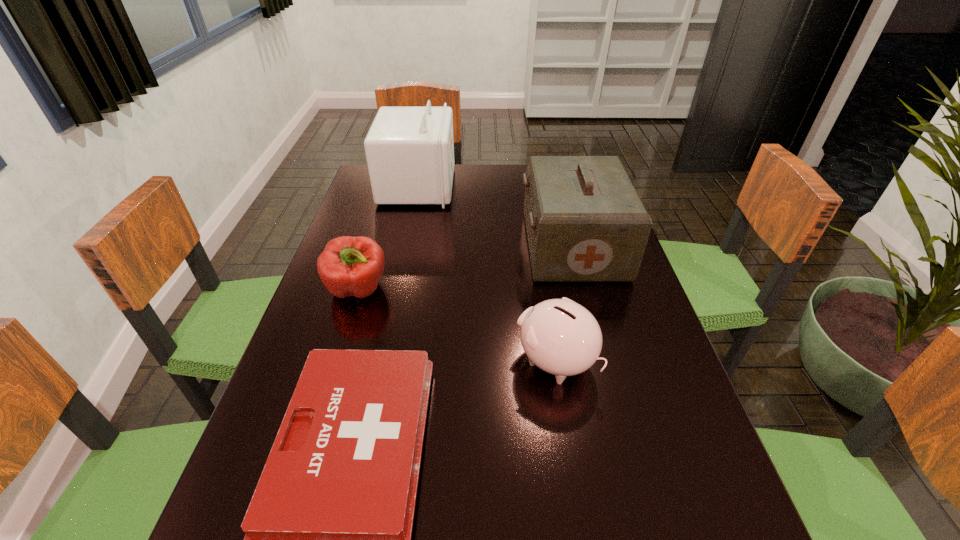
This screenshot has height=540, width=960. I want to click on free point between the bell pepper and the piggy bank, so click(x=457, y=326).

I want to click on vacant area that lies between the piggy bank and the bell pepper, so click(x=457, y=326).

This screenshot has height=540, width=960. I want to click on vacant region between the farthest first-aid kit and the piggy bank, so click(x=487, y=274).

Select which object appears as the closest to the tallest first-aid kit. Please provide its 2D coordinates. Your answer should be formatted as a tuple, i.e. [(x, y)], where the tuple contains the x and y coordinates of a point satisfying the conditions above.

[(585, 221)]

Locate which object ranks fourth in proximity to the second shortest first-aid kit. Please provide its 2D coordinates. Your answer should be formatted as a tuple, i.e. [(x, y)], where the tuple contains the x and y coordinates of a point satisfying the conditions above.

[(349, 266)]

Select which first-aid kit appears as the closest to the shortest object. Please provide its 2D coordinates. Your answer should be formatted as a tuple, i.e. [(x, y)], where the tuple contains the x and y coordinates of a point satisfying the conditions above.

[(585, 221)]

This screenshot has height=540, width=960. In order to click on the first-aid kit that is the third closest one to the bell pepper in this screenshot , I will do `click(585, 221)`.

Identify the location of free spot that satisfies the following two spatial constraints: 1. on the front-facing side of the tallest first-aid kit; 2. on the right side of the fourth shortest object. (405, 246).